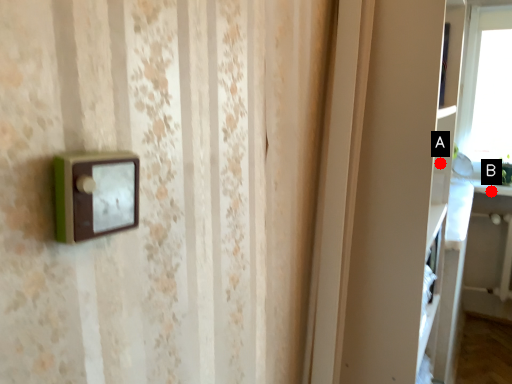
Question: Two points are circled on the image, labeled by A and B beside each circle. Which point is closer to the camera taking this photo?

Choices:
 (A) A is closer
 (B) B is closer

Answer: (A)